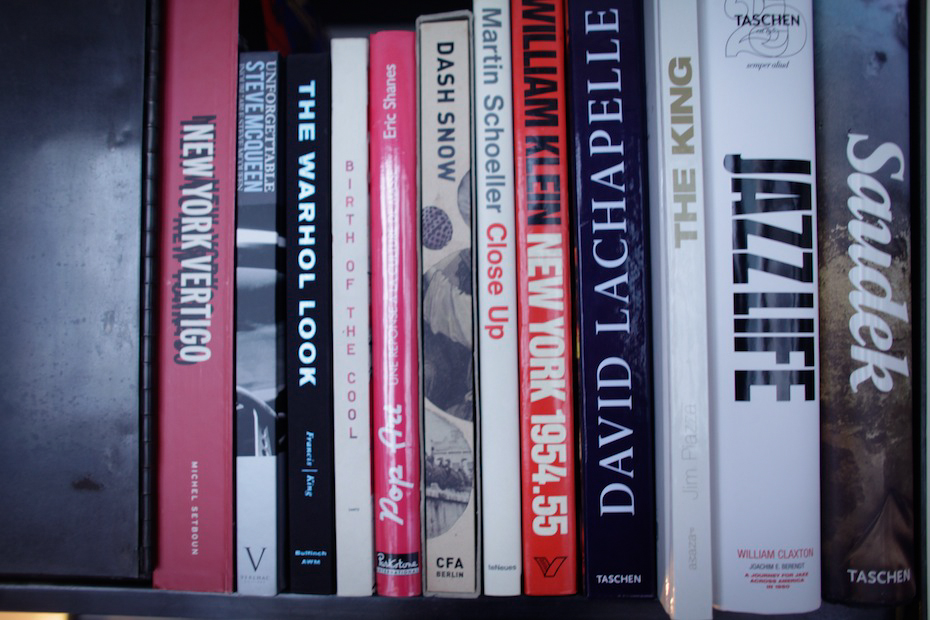
The image size is (930, 620). What are the coordinates of `bookshelf` in the screenshot? It's located at (100, 309).